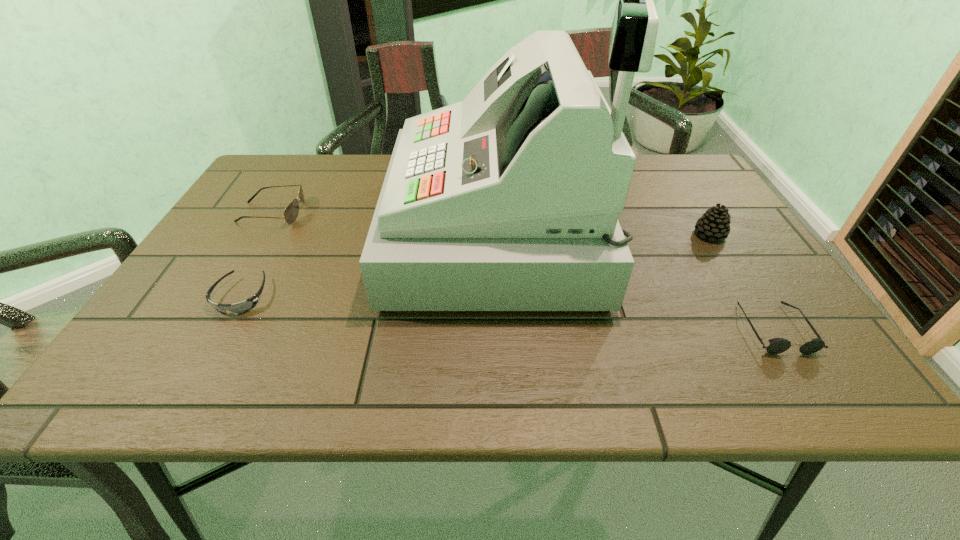
The image size is (960, 540). I want to click on vacant space at the far edge of the desktop, so click(x=326, y=168).

Where is `blank space at the near edge of the desktop`? The width and height of the screenshot is (960, 540). blank space at the near edge of the desktop is located at coordinates pyautogui.click(x=274, y=380).

This screenshot has height=540, width=960. Find the location of `free space at the right edge of the desktop`. free space at the right edge of the desktop is located at coordinates (713, 245).

Locate an element on the screen. The image size is (960, 540). free space at the near right corner is located at coordinates (817, 394).

Where is `free space between the fourth tallest object and the cash register`? The width and height of the screenshot is (960, 540). free space between the fourth tallest object and the cash register is located at coordinates (636, 281).

Find the location of a particular element. The width and height of the screenshot is (960, 540). free space between the rightmost sunglasses and the shortest sunglasses is located at coordinates (508, 312).

Identify the location of blank region between the second tallest sunglasses and the tallest object. (636, 281).

At what (x,y) coordinates should I click in order to perform the action: click on free space between the shortest object and the tallest sunglasses. Please return your answer as a coordinate pair (x, y). The height and width of the screenshot is (540, 960). Looking at the image, I should click on (257, 254).

In order to click on object that is the second nearest to the second tallest sunglasses in this screenshot , I will do `click(509, 200)`.

Identify which object is located as the second nearest to the pinecone. Please provide its 2D coordinates. Your answer should be formatted as a tuple, i.e. [(x, y)], where the tuple contains the x and y coordinates of a point satisfying the conditions above.

[(509, 200)]